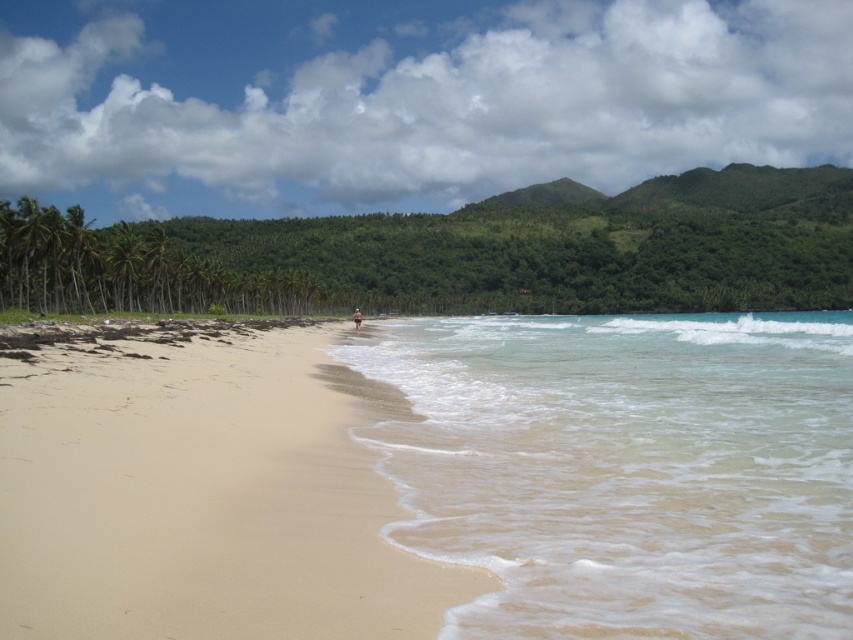
You are standing on the sandy beach at lower left and want to reach the green leafy palm tree at left. Which direction should you walk to get closer to the palm tree?

You should walk towards the left because the sandy beach at lower left is smaller than the green leafy palm tree at left, indicating it is closer to you.

You are standing on the sandy beach at lower left and want to reach the clear water at lower right. Which direction should you walk to get there?

You should walk to the right to reach the clear water at lower right because it is located to the right of the sandy beach at lower left.

You are standing at the center of the beach and want to take a photo that includes both the clear water at lower right and the sandy beach at lower left. Since you need to ensure both are fully visible in the frame, which object should you position closer to the bottom of your camera viewfinder to avoid cropping?

The clear water at lower right should be positioned closer to the bottom of the camera viewfinder because it has a greater height compared to the sandy beach at lower left, ensuring both are fully visible without cropping.